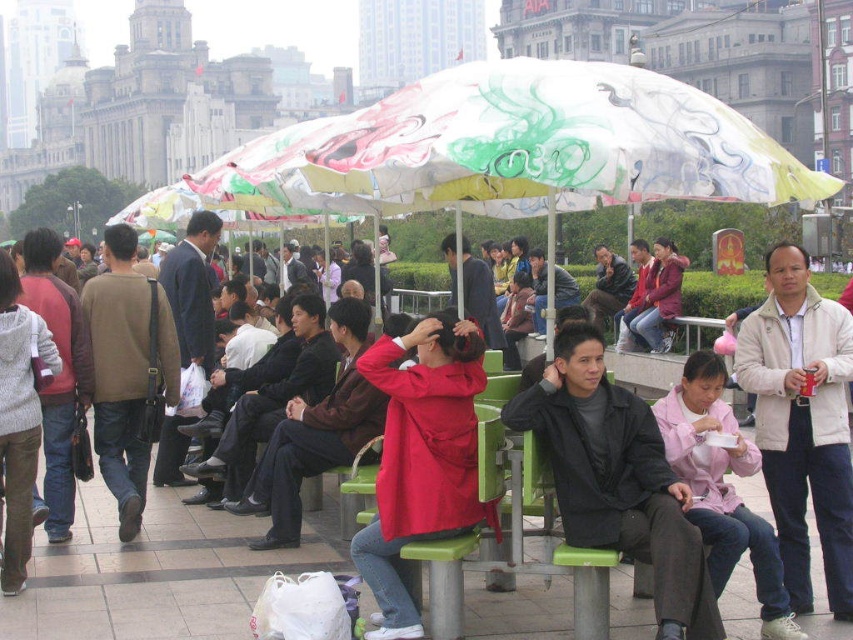
You are a tailor observing the matte black jacket at center and the brown leather jacket at left. Which jacket would you recommend to a customer who wants a jacket that reaches higher up the body?

The brown leather jacket at left is taller than the matte black jacket at center, so it would be the better recommendation for a customer seeking a jacket that reaches higher up the body.

You are a photographer trying to capture a candid shot of the matte black jacket at center and the brown leather jacket at left. The camera you have can focus on subjects within a 20 meter range. Can you take a photo that includes both jackets in focus without moving your position?

The matte black jacket at center is 18.89 meters away from the brown leather jacket at left. Since the distance between them is within the camera focus range of 20 meters, you can take a photo that includes both jackets in focus without moving your position.

You are a photographer trying to capture both the matte black jacket at center and the brown leather jacket at left in the same frame. Which jacket should you focus on first to ensure both are visible in your photo?

You should focus on the matte black jacket at center first because it is in front of the brown leather jacket at left, so positioning the camera to include the front jacket will naturally include the background one as well.